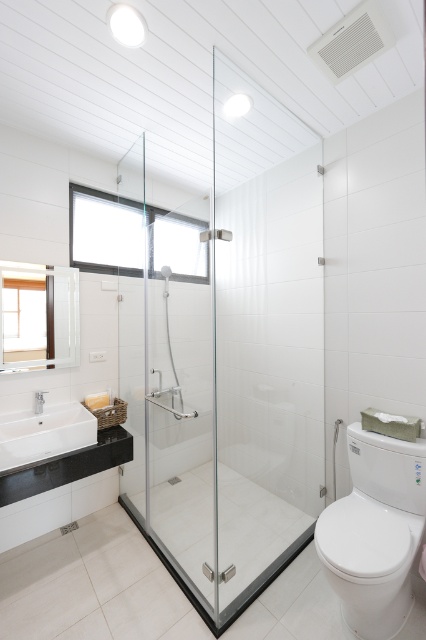
Between transparent glass shower door at center and white glossy toilet at right, which one appears on the left side from the viewer's perspective?

Positioned to the left is transparent glass shower door at center.

At what (x,y) coordinates should I click in order to perform the action: click on transparent glass shower door at center. Please return your answer as a coordinate pair (x, y). This screenshot has width=426, height=640. Looking at the image, I should click on (227, 356).

You are a GUI agent. You are given a task and a screenshot of the screen. Output one action in this format:
    pyautogui.click(x=<x>, y=<y>)
    Task: Click on the transparent glass shower door at center
    
    Given the screenshot: What is the action you would take?
    pyautogui.click(x=227, y=356)

Does white glossy sink at lower left appear over transparent glass shower at center?

Actually, white glossy sink at lower left is below transparent glass shower at center.

Looking at this image, between white glossy sink at lower left and transparent glass shower at center, which one appears on the left side from the viewer's perspective?

From the viewer's perspective, white glossy sink at lower left appears more on the left side.

Between point (6, 456) and point (167, 266), which one is positioned behind?

The point (167, 266) is more distant.

The width and height of the screenshot is (426, 640). Find the location of `white glossy sink at lower left`. white glossy sink at lower left is located at coordinates (45, 433).

Between transparent glass shower door at center and white glossy sink at lower left, which one has less height?

With less height is white glossy sink at lower left.

Between transparent glass shower door at center and white glossy sink at lower left, which one is positioned lower?

white glossy sink at lower left

At what (x,y) coordinates should I click in order to perform the action: click on transparent glass shower door at center. Please return your answer as a coordinate pair (x, y). The height and width of the screenshot is (640, 426). Looking at the image, I should click on (227, 356).